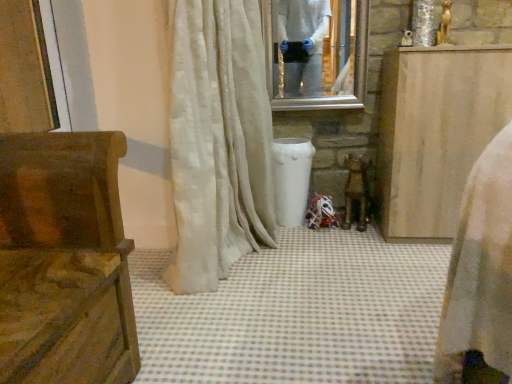
Question: Considering the positions of white silky curtain at center and wooden carved bench at left, which ranks as the second furniture in back-to-front order, in the image, is white silky curtain at center wider or thinner than wooden carved bench at left, which ranks as the second furniture in back-to-front order,?

Choices:
 (A) wide
 (B) thin

Answer: (B)

Question: Choose the correct answer: Is white silky curtain at center inside wooden carved bench at left, arranged as the 1th furniture when viewed from the left, or outside it?

Choices:
 (A) outside
 (B) inside

Answer: (A)

Question: Which object is the closest to the wooden carved bench at left, which ranks as the second furniture in back-to-front order?

Choices:
 (A) clear glass mirror at upper center
 (B) wooden at center
 (C) light brown wood cabinet at right, which is counted as the second furniture, starting from the front
 (D) white silky curtain at center

Answer: (D)

Question: Based on their relative distances, which object is nearer to the light brown wood cabinet at right, arranged as the first furniture when viewed from the right?

Choices:
 (A) wooden carved bench at left, positioned as the second furniture in right-to-left order
 (B) white silky curtain at center
 (C) clear glass mirror at upper center
 (D) wooden at center

Answer: (D)